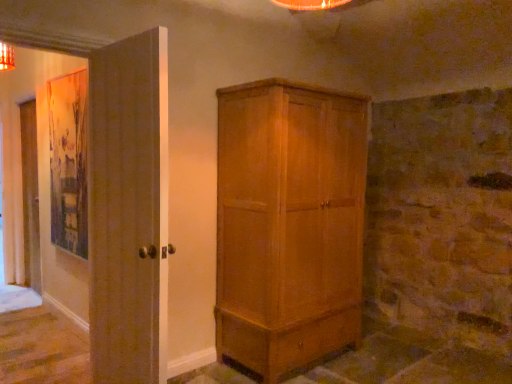
Where is `light brown wood cupboard at center`? This screenshot has height=384, width=512. light brown wood cupboard at center is located at coordinates (289, 224).

What do you see at coordinates (289, 224) in the screenshot? I see `light brown wood cupboard at center` at bounding box center [289, 224].

This screenshot has height=384, width=512. What do you see at coordinates (129, 209) in the screenshot? I see `matte brown door at left` at bounding box center [129, 209].

Measure the distance between point (128,270) and camera.

The depth of point (128,270) is 2.10 meters.

This screenshot has height=384, width=512. I want to click on matte brown door at left, so click(x=129, y=209).

This screenshot has width=512, height=384. Identify the location of light brown wood cupboard at center. (289, 224).

Is matte brown door at left at the right side of light brown wood cupboard at center?

In fact, matte brown door at left is to the left of light brown wood cupboard at center.

Which object is further away from the camera taking this photo, matte brown door at left or light brown wood cupboard at center?

light brown wood cupboard at center.

Considering the positions of points (128, 259) and (317, 138), is point (128, 259) farther from camera compared to point (317, 138)?

No, it is in front of (317, 138).

From the image's perspective, which is above, matte brown door at left or light brown wood cupboard at center?

matte brown door at left, from the image's perspective.

From a real-world perspective, who is located lower, matte brown door at left or light brown wood cupboard at center?

light brown wood cupboard at center.

Which object is thinner, matte brown door at left or light brown wood cupboard at center?

matte brown door at left is thinner.

Considering the relative sizes of matte brown door at left and light brown wood cupboard at center in the image provided, is matte brown door at left shorter than light brown wood cupboard at center?

Correct, matte brown door at left is not as tall as light brown wood cupboard at center.

Considering the sizes of objects matte brown door at left and light brown wood cupboard at center in the image provided, who is smaller, matte brown door at left or light brown wood cupboard at center?

Smaller between the two is matte brown door at left.

Choose the correct answer: Is matte brown door at left inside light brown wood cupboard at center or outside it?

matte brown door at left is outside light brown wood cupboard at center.

Is matte brown door at left touching light brown wood cupboard at center?

No, matte brown door at left is not next to light brown wood cupboard at center.

Is matte brown door at left aimed at light brown wood cupboard at center?

No, matte brown door at left is not turned towards light brown wood cupboard at center.

How many degrees apart are the facing directions of matte brown door at left and light brown wood cupboard at center?

The angle between the facing direction of matte brown door at left and the facing direction of light brown wood cupboard at center is 85.8 degrees.

Identify the location of cupboard behind the matte brown door at left. Image resolution: width=512 pixels, height=384 pixels. (289, 224).

Is light brown wood cupboard at center at the left side of matte brown door at left?

In fact, light brown wood cupboard at center is to the right of matte brown door at left.

Looking at this image, between light brown wood cupboard at center and matte brown door at left, which one is positioned in front?

matte brown door at left is closer to the camera.

Is point (285, 108) behind point (96, 145)?

Yes, it is.

From the image's perspective, is light brown wood cupboard at center positioned above or below matte brown door at left?

Clearly, from the image's perspective, light brown wood cupboard at center is below matte brown door at left.

From a real-world perspective, who is located lower, light brown wood cupboard at center or matte brown door at left?

light brown wood cupboard at center.

Which of these two, light brown wood cupboard at center or matte brown door at left, is thinner?

Thinner between the two is matte brown door at left.

Considering the relative sizes of light brown wood cupboard at center and matte brown door at left in the image provided, is light brown wood cupboard at center shorter than matte brown door at left?

Incorrect, the height of light brown wood cupboard at center does not fall short of that of matte brown door at left.

Based on the photo, who is bigger, light brown wood cupboard at center or matte brown door at left?

With larger size is light brown wood cupboard at center.

Is light brown wood cupboard at center completely or partially outside of matte brown door at left?

Yes, light brown wood cupboard at center is located beyond the bounds of matte brown door at left.

Is light brown wood cupboard at center directly adjacent to matte brown door at left?

light brown wood cupboard at center and matte brown door at left are clearly separated.

Is matte brown door at left at the back of light brown wood cupboard at center?

No, light brown wood cupboard at center is not facing away from matte brown door at left.

What's the angular difference between light brown wood cupboard at center and matte brown door at left's facing directions?

The angle between the facing direction of light brown wood cupboard at center and the facing direction of matte brown door at left is 85.8 degrees.

Looking at this image, measure the distance between light brown wood cupboard at center and matte brown door at left.

The distance of light brown wood cupboard at center from matte brown door at left is 3.32 feet.

Where is `cupboard beneath the matte brown door at left (from a real-world perspective)`? The image size is (512, 384). cupboard beneath the matte brown door at left (from a real-world perspective) is located at coordinates (289, 224).

Find the location of a particular element. The height and width of the screenshot is (384, 512). cupboard behind the matte brown door at left is located at coordinates (289, 224).

Where is `cupboard below the matte brown door at left (from a real-world perspective)`? The width and height of the screenshot is (512, 384). cupboard below the matte brown door at left (from a real-world perspective) is located at coordinates (289, 224).